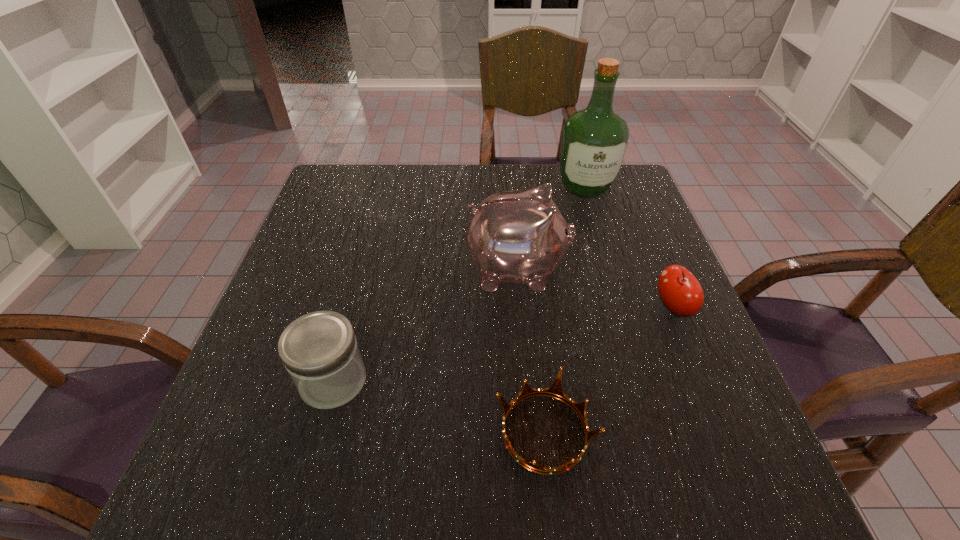
Locate an element on the screen. This screenshot has height=540, width=960. the farthest object is located at coordinates (594, 141).

In order to click on liquor in this screenshot , I will do `click(594, 141)`.

Locate an element on the screen. The image size is (960, 540). piggy bank is located at coordinates (520, 236).

Find the location of a particular element. Image resolution: width=960 pixels, height=540 pixels. jar is located at coordinates (320, 352).

The image size is (960, 540). Identify the location of the second shortest object. (679, 290).

You are a GUI agent. You are given a task and a screenshot of the screen. Output one action in this format:
    pyautogui.click(x=<x>, y=<y>)
    Task: Click on the crown
    
    Given the screenshot: What is the action you would take?
    pyautogui.click(x=555, y=390)

In order to click on vacant space located on the front-facing side of the farthest object in this screenshot , I will do `click(618, 300)`.

The image size is (960, 540). What are the coordinates of `vacant point located 0.090m on the front facing side of the piggy bank` in the screenshot? It's located at (607, 270).

Locate an element on the screen. The height and width of the screenshot is (540, 960). free spot located on the right of the leftmost object is located at coordinates (474, 380).

Find the location of `vacant space located 0.070m on the back of the apple`. vacant space located 0.070m on the back of the apple is located at coordinates (657, 267).